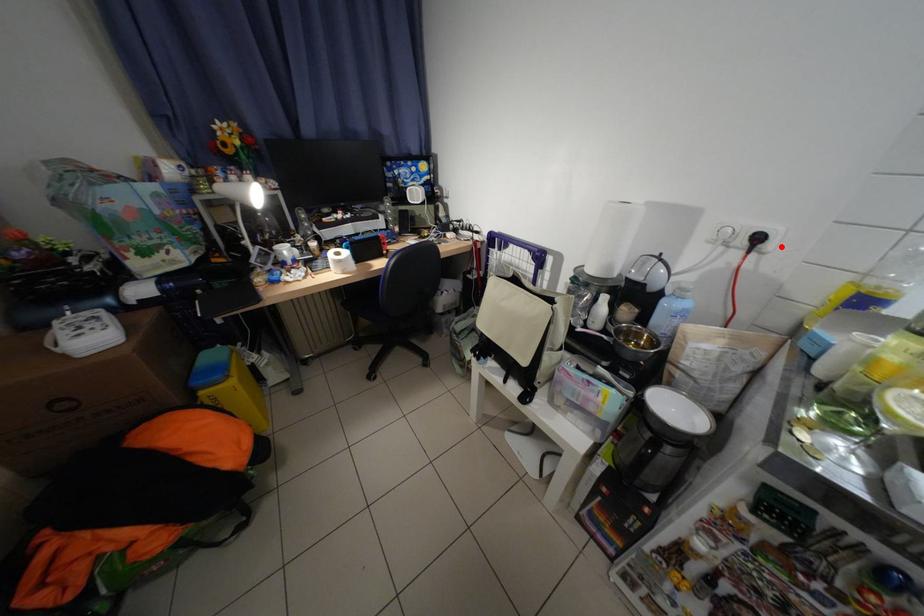
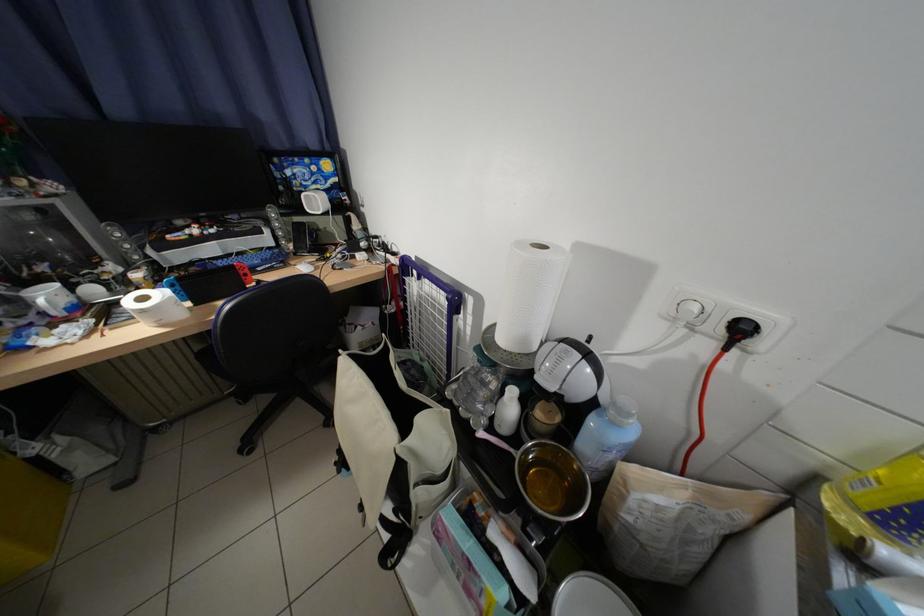
Find the pixel in the second image that matches the highlighted location in the first image.

(772, 345)